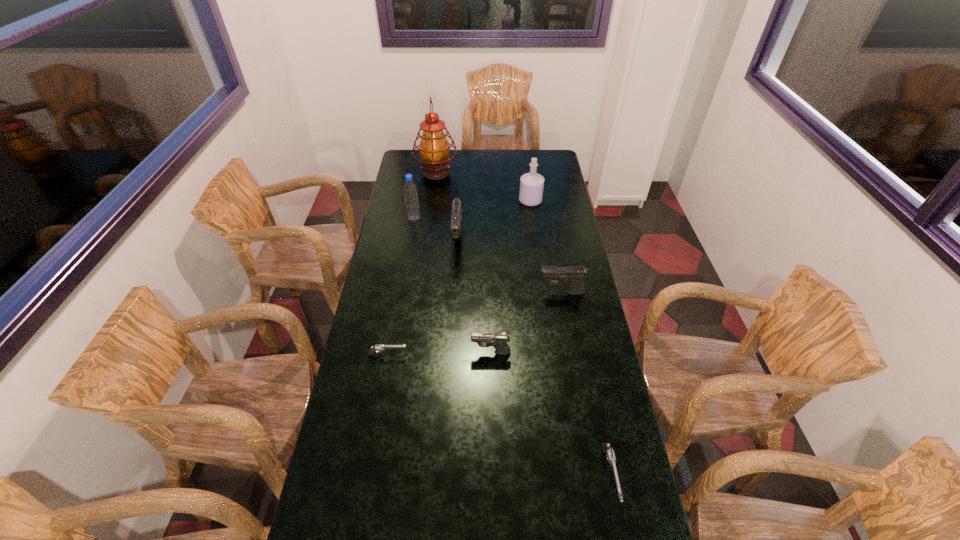
The width and height of the screenshot is (960, 540). In order to click on perfume present at the right edge in this screenshot , I will do `click(531, 184)`.

Identify the location of object that is at the far left corner. The width and height of the screenshot is (960, 540). (434, 149).

This screenshot has height=540, width=960. In the image, there is a desktop. Find the location of `vacant space at the far edge`. vacant space at the far edge is located at coordinates (452, 151).

In the image, there is a desktop. Identify the location of free space at the left edge. (356, 377).

Locate an element on the screen. free space between the biggest black pistol and the second black pistol from left to right is located at coordinates (474, 297).

Locate an element on the screen. vacant space that's between the third farthest object and the shortest pistol is located at coordinates (400, 287).

Find the location of a particular element. unoccupied position between the second shortest object and the sixth tallest object is located at coordinates (550, 414).

Locate an element on the screen. free area in between the fifth shortest object and the sixth nearest object is located at coordinates (436, 230).

What are the coordinates of `free space between the sixth nearest object and the tallest pistol` in the screenshot? It's located at (436, 230).

Locate an element on the screen. The width and height of the screenshot is (960, 540). vacant space that's between the sixth tallest object and the third farthest object is located at coordinates (452, 285).